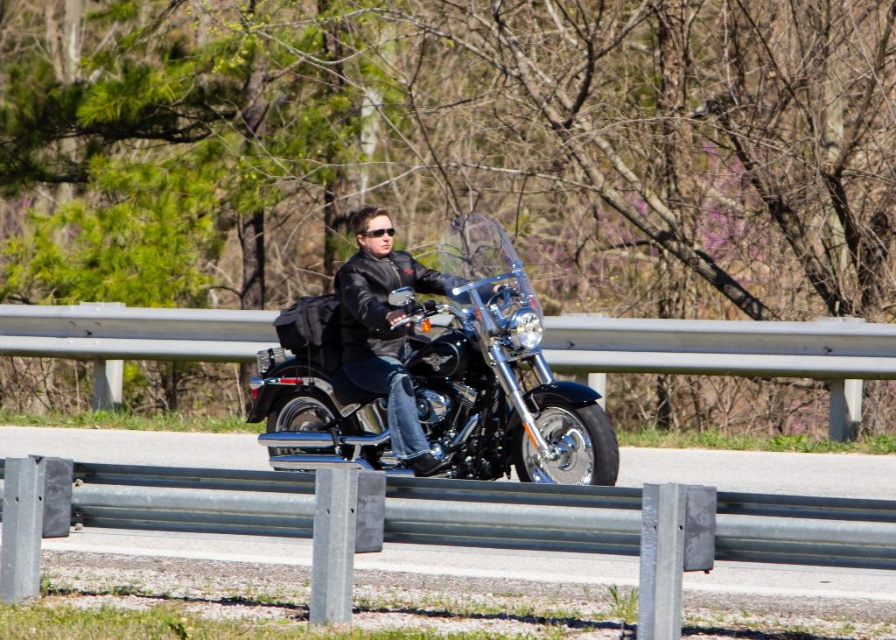
Question: Can you confirm if black leather jacket at center is positioned to the left of black plastic sunglasses at center?

Choices:
 (A) no
 (B) yes

Answer: (A)

Question: Does shiny chrome motorcycle at center lie in front of black plastic sunglasses at center?

Choices:
 (A) yes
 (B) no

Answer: (A)

Question: Which is farther from the black leather jacket at center?

Choices:
 (A) shiny chrome motorcycle at center
 (B) black plastic sunglasses at center

Answer: (B)

Question: Does shiny chrome motorcycle at center appear under black plastic sunglasses at center?

Choices:
 (A) yes
 (B) no

Answer: (A)

Question: Which point appears closest to the camera in this image?

Choices:
 (A) (372, 234)
 (B) (371, 364)
 (C) (593, 412)

Answer: (C)

Question: Among these points, which one is nearest to the camera?

Choices:
 (A) (449, 312)
 (B) (372, 243)
 (C) (386, 228)

Answer: (A)